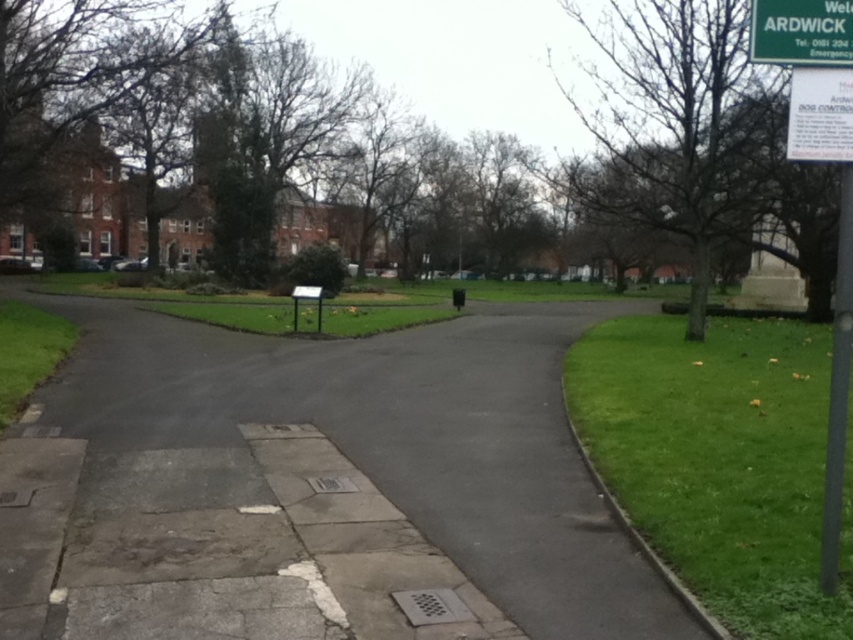
You are standing at the entrance of the park and see a point marked at coordinates (312, 486). According to the image, what type of surface is this point located on?

The point (312, 486) is located on the gray concrete pavement at center.

You are a delivery person trying to park your bike near the gray concrete pavement at center and the black metal pole at right. Which object should you park closer to if you want to avoid blocking the pathway?

The gray concrete pavement at center has a smaller size compared to black metal pole at right, so you should park closer to the gray concrete pavement at center to avoid blocking the pathway.